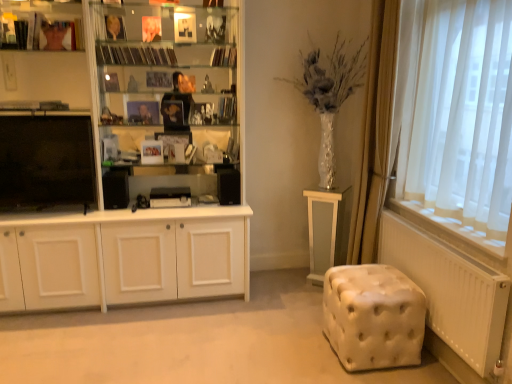
What do you see at coordinates (373, 316) in the screenshot?
I see `white tufted ottoman at lower right` at bounding box center [373, 316].

I want to click on gold metallic book at upper center, marked as the 1th book in a left-to-right arrangement, so click(115, 27).

Find the location of a particular element. Image resolution: width=512 pixels, height=384 pixels. white glossy cupboard at left is located at coordinates (134, 180).

In order to face hardcover book at upper center, the 3th book in the left-to-right sequence, should I rotate leftwards or rightwards?

Turn left approximately 4.435 degrees to face it.

What do you see at coordinates (224, 57) in the screenshot? This screenshot has height=384, width=512. I see `hardcover book at upper center, the 3th book in the left-to-right sequence` at bounding box center [224, 57].

Find the location of a particular element. The height and width of the screenshot is (384, 512). matte black books at upper left is located at coordinates (38, 22).

Image resolution: width=512 pixels, height=384 pixels. What do you see at coordinates (227, 109) in the screenshot?
I see `hardcover book at upper center, which is the 1th book in right-to-left order` at bounding box center [227, 109].

In order to click on white tufted ottoman at lower right in this screenshot , I will do `click(373, 316)`.

Can you confirm if gold metallic book at upper center, marked as the 1th book in a left-to-right arrangement, is smaller than white glossy table at lower right?

Yes.

Is gold metallic book at upper center, marked as the 1th book in a left-to-right arrangement, aimed at white glossy table at lower right?

No.

Which is more to the left, gold metallic book at upper center, marked as the 1th book in a left-to-right arrangement, or white glossy table at lower right?

gold metallic book at upper center, marked as the 1th book in a left-to-right arrangement.

Can you tell me how much gold metallic book at upper center, the 4th book viewed from the right, and white glossy table at lower right differ in facing direction?

The angle between the facing direction of gold metallic book at upper center, the 4th book viewed from the right, and the facing direction of white glossy table at lower right is 58 degrees.

Is gold metallic book at upper center, the 4th book viewed from the right, positioned before hardcover book at upper center, placed as the 2th book when sorted from right to left?

That is True.

Which is more to the right, gold metallic book at upper center, marked as the 1th book in a left-to-right arrangement, or hardcover book at upper center, the 3th book in the left-to-right sequence?

Positioned to the right is hardcover book at upper center, the 3th book in the left-to-right sequence.

This screenshot has height=384, width=512. I want to click on the 2nd book to the right when counting from the gold metallic book at upper center, the 4th book viewed from the right, so click(x=224, y=57).

Looking at the image, does gold metallic book at upper center, marked as the 1th book in a left-to-right arrangement, seem bigger or smaller compared to hardcover book at upper center, the 3th book in the left-to-right sequence?

Considering their sizes, gold metallic book at upper center, marked as the 1th book in a left-to-right arrangement, takes up less space than hardcover book at upper center, the 3th book in the left-to-right sequence.

Image resolution: width=512 pixels, height=384 pixels. Find the location of `the 2nd book below when counting from the gold metallic book at upper center, the 4th book viewed from the right (from the image's perspective)`. the 2nd book below when counting from the gold metallic book at upper center, the 4th book viewed from the right (from the image's perspective) is located at coordinates click(135, 55).

In the scene shown: What's the angular difference between gold metallic book at upper center, the 4th book viewed from the right, and black matte bookshelf at upper center, the second book from the left,'s facing directions?

23.2 degrees.

Which object is closer to the camera taking this photo, gold metallic book at upper center, marked as the 1th book in a left-to-right arrangement, or black matte bookshelf at upper center, the third book when ordered from right to left?

Positioned in front is gold metallic book at upper center, marked as the 1th book in a left-to-right arrangement.

Is gold metallic book at upper center, marked as the 1th book in a left-to-right arrangement, positioned far away from black matte bookshelf at upper center, the third book when ordered from right to left?

Actually, gold metallic book at upper center, marked as the 1th book in a left-to-right arrangement, and black matte bookshelf at upper center, the third book when ordered from right to left, are a little close together.

Is black matte bookshelf at upper center, the second book from the left, looking in the opposite direction of hardcover book at upper center, which is counted as the fourth book, starting from the left?

black matte bookshelf at upper center, the second book from the left, does not have its back to hardcover book at upper center, which is counted as the fourth book, starting from the left.

In the scene shown: Considering the sizes of black matte bookshelf at upper center, the second book from the left, and hardcover book at upper center, which is counted as the fourth book, starting from the left, in the image, is black matte bookshelf at upper center, the second book from the left, taller or shorter than hardcover book at upper center, which is counted as the fourth book, starting from the left,?

Clearly, black matte bookshelf at upper center, the second book from the left, is shorter compared to hardcover book at upper center, which is counted as the fourth book, starting from the left.

Based on the photo, from a real-world perspective, is black matte bookshelf at upper center, the third book when ordered from right to left, positioned above or below hardcover book at upper center, which is counted as the fourth book, starting from the left?

From a real-world perspective, black matte bookshelf at upper center, the third book when ordered from right to left, is physically above hardcover book at upper center, which is counted as the fourth book, starting from the left.

Which is behind, black matte bookshelf at upper center, the third book when ordered from right to left, or hardcover book at upper center, which is the 1th book in right-to-left order?

hardcover book at upper center, which is the 1th book in right-to-left order, is more distant.

Which is more to the right, black matte bookshelf at upper center, the third book when ordered from right to left, or hardcover book at upper center, placed as the 2th book when sorted from right to left?

hardcover book at upper center, placed as the 2th book when sorted from right to left, is more to the right.

Which object is closer to the camera, black matte bookshelf at upper center, the second book from the left, or hardcover book at upper center, placed as the 2th book when sorted from right to left?

black matte bookshelf at upper center, the second book from the left, is in front.

Considering the positions of points (154, 53) and (234, 50), is point (154, 53) farther from camera compared to point (234, 50)?

No, (154, 53) is in front of (234, 50).

Is the surface of black matte bookshelf at upper center, the third book when ordered from right to left, in direct contact with hardcover book at upper center, placed as the 2th book when sorted from right to left?

No, black matte bookshelf at upper center, the third book when ordered from right to left, is not with hardcover book at upper center, placed as the 2th book when sorted from right to left.

Looking at this image, is hardcover book at upper center, which is the 1th book in right-to-left order, oriented away from hardcover book at upper center, the 3th book in the left-to-right sequence?

No, hardcover book at upper center, which is the 1th book in right-to-left order, is not facing away from hardcover book at upper center, the 3th book in the left-to-right sequence.

Choose the correct answer: Is hardcover book at upper center, which is counted as the fourth book, starting from the left, inside hardcover book at upper center, placed as the 2th book when sorted from right to left, or outside it?

hardcover book at upper center, which is counted as the fourth book, starting from the left, is not enclosed by hardcover book at upper center, placed as the 2th book when sorted from right to left.

How different are the orientations of hardcover book at upper center, which is the 1th book in right-to-left order, and hardcover book at upper center, placed as the 2th book when sorted from right to left, in degrees?

The facing directions of hardcover book at upper center, which is the 1th book in right-to-left order, and hardcover book at upper center, placed as the 2th book when sorted from right to left, are 5.03 degrees apart.

From the image's perspective, is hardcover book at upper center, which is the 1th book in right-to-left order, located above or below hardcover book at upper center, placed as the 2th book when sorted from right to left?

hardcover book at upper center, which is the 1th book in right-to-left order, is situated lower than hardcover book at upper center, placed as the 2th book when sorted from right to left, in the image.

Looking at this image, is white glossy cupboard at left facing towards white tufted ottoman at lower right?

No, white glossy cupboard at left does not turn towards white tufted ottoman at lower right.

Is point (197, 18) farther from camera compared to point (361, 300)?

Yes.

Which object is wider, white glossy cupboard at left or white tufted ottoman at lower right?

white glossy cupboard at left.

This screenshot has width=512, height=384. In order to click on cupboard on the left of white tufted ottoman at lower right in this screenshot , I will do `click(134, 180)`.

Image resolution: width=512 pixels, height=384 pixels. What are the coordinates of `book that is the 4th one when counting forward from the white glossy table at lower right` in the screenshot? It's located at (115, 27).

Find the location of a particular element. the 2nd book directly beneath the gold metallic book at upper center, the 4th book viewed from the right (from a real-world perspective) is located at coordinates (224, 57).

Based on their spatial positions, is black matte bookshelf at upper center, the second book from the left, or white glossy cupboard at left closer to matte black books at upper left?

Among the two, black matte bookshelf at upper center, the second book from the left, is located nearer to matte black books at upper left.

When comparing their distances from hardcover book at upper center, which is the 1th book in right-to-left order, does gold metallic book at upper center, the 4th book viewed from the right, or white glossy table at lower right seem further?

Based on the image, white glossy table at lower right appears to be further to hardcover book at upper center, which is the 1th book in right-to-left order.

When comparing their distances from hardcover book at upper center, which is counted as the fourth book, starting from the left, does black matte bookshelf at upper center, the second book from the left, or white glossy table at lower right seem further?

white glossy table at lower right lies further to hardcover book at upper center, which is counted as the fourth book, starting from the left, than the other object.

Looking at the image, which one is located closer to white glossy table at lower right, black matte bookshelf at upper center, the third book when ordered from right to left, or matte black books at upper left?

The object closer to white glossy table at lower right is black matte bookshelf at upper center, the third book when ordered from right to left.

Considering their positions, is hardcover book at upper center, the 3th book in the left-to-right sequence, positioned closer to white glossy table at lower right than white glossy cupboard at left?

Based on the image, white glossy cupboard at left appears to be nearer to white glossy table at lower right.

Considering their positions, is hardcover book at upper center, the 3th book in the left-to-right sequence, positioned closer to gold metallic book at upper center, the 4th book viewed from the right, than white tufted ottoman at lower right?

hardcover book at upper center, the 3th book in the left-to-right sequence, is positioned closer to the anchor gold metallic book at upper center, the 4th book viewed from the right.

Considering their positions, is white glossy cupboard at left positioned further to hardcover book at upper center, which is the 1th book in right-to-left order, than gold metallic book at upper center, marked as the 1th book in a left-to-right arrangement?

gold metallic book at upper center, marked as the 1th book in a left-to-right arrangement, lies further to hardcover book at upper center, which is the 1th book in right-to-left order, than the other object.

Based on their spatial positions, is white tufted ottoman at lower right or black matte bookshelf at upper center, the second book from the left, closer to white glossy table at lower right?

The object closer to white glossy table at lower right is white tufted ottoman at lower right.

The image size is (512, 384). Find the location of `book located between black matte bookshelf at upper center, the second book from the left, and hardcover book at upper center, which is counted as the fourth book, starting from the left, in the left-right direction`. book located between black matte bookshelf at upper center, the second book from the left, and hardcover book at upper center, which is counted as the fourth book, starting from the left, in the left-right direction is located at coordinates point(224,57).

Find the location of a particular element. book between gold metallic book at upper center, marked as the 1th book in a left-to-right arrangement, and hardcover book at upper center, the 3th book in the left-to-right sequence, in the horizontal direction is located at coordinates (135, 55).

This screenshot has height=384, width=512. In order to click on table located between white glossy cupboard at left and white tufted ottoman at lower right in the left-right direction in this screenshot , I will do `click(325, 229)`.

This screenshot has height=384, width=512. I want to click on cupboard between matte black books at upper left and hardcover book at upper center, the 3th book in the left-to-right sequence, so click(134, 180).